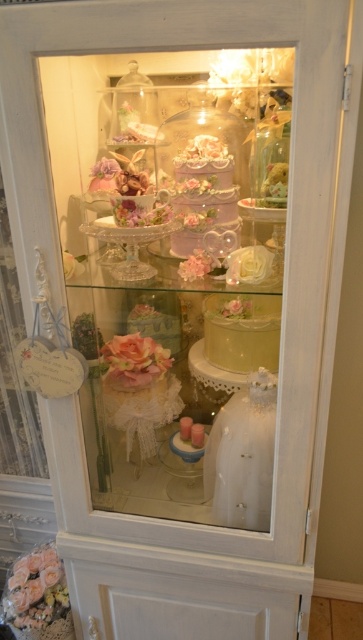
You are a customer in a bakery and want to take a photo of the pastel pink fondant cake at center and the matte pink cake at center. Which cake should you focus on first to ensure both are in the frame?

You should focus on the pastel pink fondant cake at center first since it is in front of the matte pink cake at center, ensuring both are visible in the photo.

You are a visitor at a bakery display and want to know which cake is taller between the pastel pink fondant cake at center and the matte pink cake at center. Can you tell me?

The pastel pink fondant cake at center is taller than the matte pink cake at center.